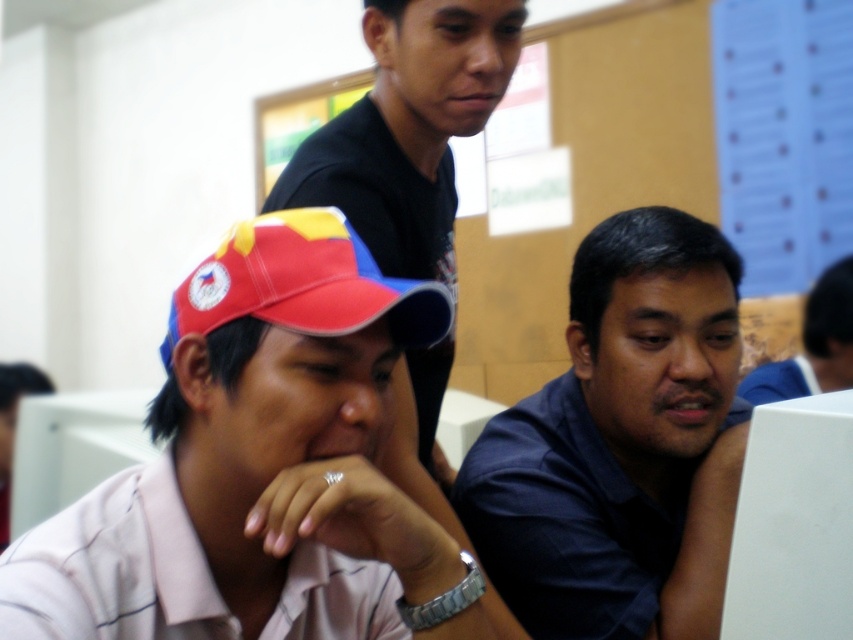
From the picture: Who is shorter, dark blue shirt at center or red fabric cap at lower left?

red fabric cap at lower left

The width and height of the screenshot is (853, 640). Describe the element at coordinates (611, 433) in the screenshot. I see `dark blue shirt at center` at that location.

Find the location of a particular element. This screenshot has height=640, width=853. dark blue shirt at center is located at coordinates (611, 433).

Who is more forward, [114,561] or [425,349]?

Point [114,561] is more forward.

Find the location of `matte pink shirt at center`. matte pink shirt at center is located at coordinates (262, 467).

Where is `matte pink shirt at center`? This screenshot has height=640, width=853. matte pink shirt at center is located at coordinates (262, 467).

Does matte pink shirt at center have a larger size compared to dark blue shirt at center?

No.

Is point (73, 529) positioned in front of point (656, 205)?

That is True.

The height and width of the screenshot is (640, 853). In order to click on matte pink shirt at center in this screenshot , I will do `click(262, 467)`.